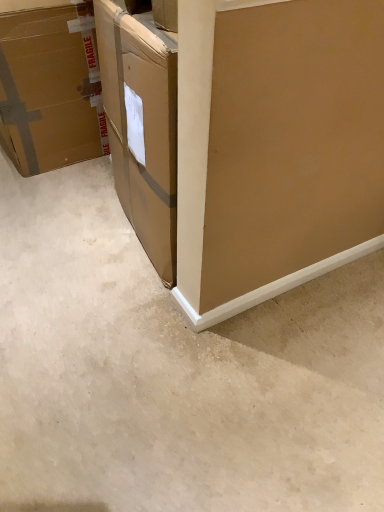
What do you see at coordinates (50, 86) in the screenshot? This screenshot has height=512, width=384. I see `brown cardboard box at left` at bounding box center [50, 86].

What is the approximate width of brown cardboard box at left?

21.44 inches.

Find the location of a particular element. brown cardboard box at left is located at coordinates (50, 86).

Locate an element on the screen. Image resolution: width=384 pixels, height=512 pixels. beige carpet at lower left is located at coordinates (174, 372).

What do you see at coordinates (174, 372) in the screenshot? I see `beige carpet at lower left` at bounding box center [174, 372].

Identify the location of brown cardboard box at left. (50, 86).

Which object is positioned more to the right, beige carpet at lower left or brown cardboard box at left?

beige carpet at lower left.

Which object is more forward, beige carpet at lower left or brown cardboard box at left?

beige carpet at lower left is more forward.

Which is closer to the camera, (x=124, y=503) or (x=87, y=106)?

Point (x=124, y=503) is positioned closer to the camera compared to point (x=87, y=106).

From the image's perspective, which one is positioned higher, beige carpet at lower left or brown cardboard box at left?

brown cardboard box at left appears higher in the image.

From a real-world perspective, is beige carpet at lower left physically located above or below brown cardboard box at left?

beige carpet at lower left is below brown cardboard box at left.

Can you confirm if beige carpet at lower left is thinner than brown cardboard box at left?

No, beige carpet at lower left is not thinner than brown cardboard box at left.

Who is taller, beige carpet at lower left or brown cardboard box at left?

brown cardboard box at left is taller.

Considering the sizes of beige carpet at lower left and brown cardboard box at left in the image, is beige carpet at lower left bigger or smaller than brown cardboard box at left?

Considering their sizes, beige carpet at lower left takes up less space than brown cardboard box at left.

Which is correct: beige carpet at lower left is inside brown cardboard box at left, or outside of it?

beige carpet at lower left is not enclosed by brown cardboard box at left.

Consider the image. Are beige carpet at lower left and brown cardboard box at left making contact?

No, beige carpet at lower left is not beside brown cardboard box at left.

Could you tell me if beige carpet at lower left is turned towards brown cardboard box at left?

No, beige carpet at lower left is not facing towards brown cardboard box at left.

How different are the orientations of beige carpet at lower left and brown cardboard box at left in degrees?

88.6 degrees separate the facing orientations of beige carpet at lower left and brown cardboard box at left.

This screenshot has width=384, height=512. Identify the location of box that is behind the beige carpet at lower left. (50, 86).

Between brown cardboard box at left and beige carpet at lower left, which one appears on the right side from the viewer's perspective?

Positioned to the right is beige carpet at lower left.

Considering their positions, is brown cardboard box at left located in front of or behind beige carpet at lower left?

Visually, brown cardboard box at left is located behind beige carpet at lower left.

Is point (39, 130) more distant than point (263, 428)?

That is True.

From the image's perspective, is brown cardboard box at left located above beige carpet at lower left?

Correct, brown cardboard box at left appears higher than beige carpet at lower left in the image.

From a real-world perspective, is brown cardboard box at left physically above beige carpet at lower left?

Indeed, from a real-world perspective, brown cardboard box at left stands above beige carpet at lower left.

In terms of width, does brown cardboard box at left look wider or thinner when compared to beige carpet at lower left?

Clearly, brown cardboard box at left has less width compared to beige carpet at lower left.

Considering the sizes of objects brown cardboard box at left and beige carpet at lower left in the image provided, who is shorter, brown cardboard box at left or beige carpet at lower left?

With less height is beige carpet at lower left.

Looking at the image, does brown cardboard box at left seem bigger or smaller compared to beige carpet at lower left?

Clearly, brown cardboard box at left is larger in size than beige carpet at lower left.

Is brown cardboard box at left not within beige carpet at lower left?

That's correct, brown cardboard box at left is outside of beige carpet at lower left.

Is brown cardboard box at left not close to beige carpet at lower left?

brown cardboard box at left is actually quite close to beige carpet at lower left.

Could you tell me if brown cardboard box at left is facing beige carpet at lower left?

No, brown cardboard box at left is not aimed at beige carpet at lower left.

What's the angular difference between brown cardboard box at left and beige carpet at lower left's facing directions?

brown cardboard box at left and beige carpet at lower left are facing 88.6 degrees away from each other.

How distant is brown cardboard box at left from beige carpet at lower left?

brown cardboard box at left is 34.52 inches from beige carpet at lower left.

Find the location of a particular element. The height and width of the screenshot is (512, 384). concrete that is under the brown cardboard box at left (from a real-world perspective) is located at coordinates pyautogui.click(x=174, y=372).

At what (x,y) coordinates should I click in order to perform the action: click on box on the left of beige carpet at lower left. Please return your answer as a coordinate pair (x, y). Looking at the image, I should click on (50, 86).

Identify the location of concrete in front of the brown cardboard box at left. (174, 372).